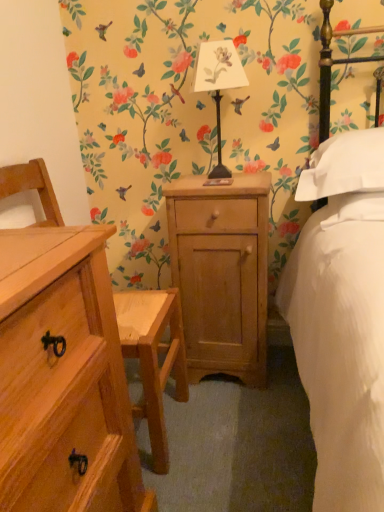
The image size is (384, 512). Find the location of `free space underneath metallic black lamp at center (from a real-world perspective)`. free space underneath metallic black lamp at center (from a real-world perspective) is located at coordinates (217, 179).